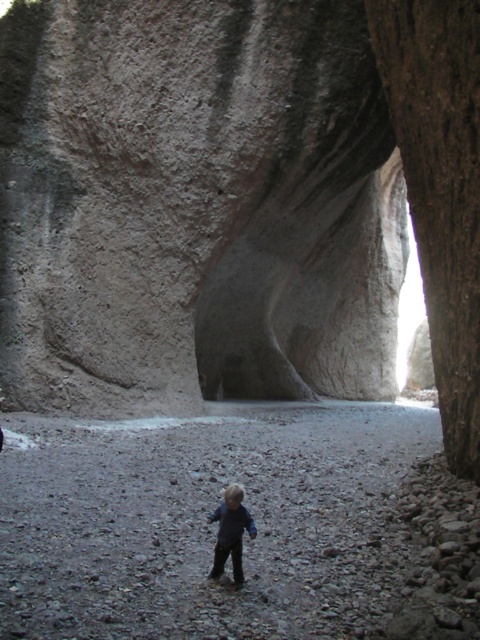
You are a parent watching your child standing near the gray rough rock face at center and the dark blue jeans at center. Are the child and the rock face positioned in a way that the rock face could potentially fall onto the child? Please explain based on their positions.

The gray rough rock face at center is located above dark blue jeans at center, which are part of the child. Since the rock face is positioned above the child, there is a potential risk that it could fall onto the child. However, the description does not provide information about the stability of the rock face or the distance between them, so caution is advised.

You are a hiker who wants to take a photo of the gray rough rock face at center and the dark blue jeans at center. Which object should you focus on first if you want to capture both in the same frame without moving the camera?

You should focus on the gray rough rock face at center first because it is positioned to the right of the dark blue jeans at center, so adjusting focus to the rock will ensure both are in the frame without needing to reposition the camera.

You are standing at the entrance of the large rock formation and want to take a photo of the point at coordinates [319,122]. If your camera has a focal length of 35mm and you are 27.13 meters away from the point, what is the approximate angle of view needed to capture the entire scene in your photo?

The point at coordinates [319,122] is 27.13 meters away from the camera. To calculate the angle of view, use the formula angle of view in radians equals 2 times arctangent of half the sensor width divided by focal length. However, without knowing the sensor size, it is impossible to determine the exact angle of view required. Therefore, the question cannot be answered with the given information.